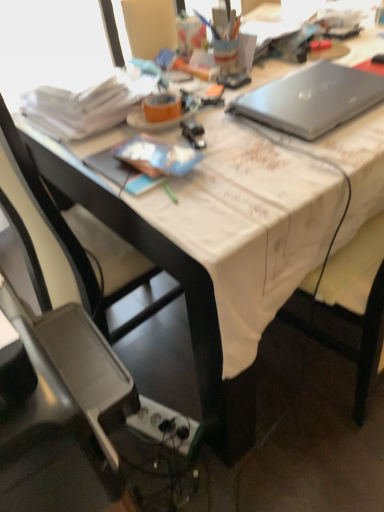
You are a GUI agent. You are given a task and a screenshot of the screen. Output one action in this format:
    pyautogui.click(x=<x>, y=<y>)
    Task: Click on the vacant space that is to the left of metallic silver stapler at center
    The height and width of the screenshot is (512, 384).
    Given the screenshot: What is the action you would take?
    pyautogui.click(x=108, y=146)